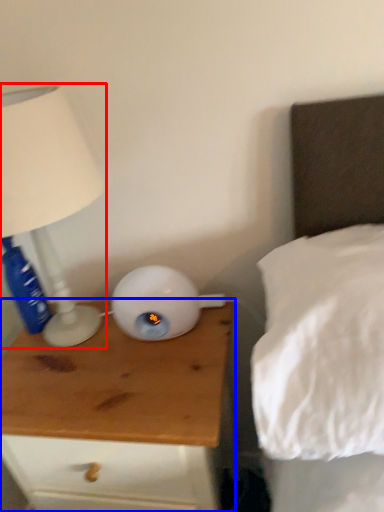
Question: Which object appears closest to the camera in this image, lamp (highlighted by a red box) or nightstand (highlighted by a blue box)?

Choices:
 (A) lamp
 (B) nightstand

Answer: (A)